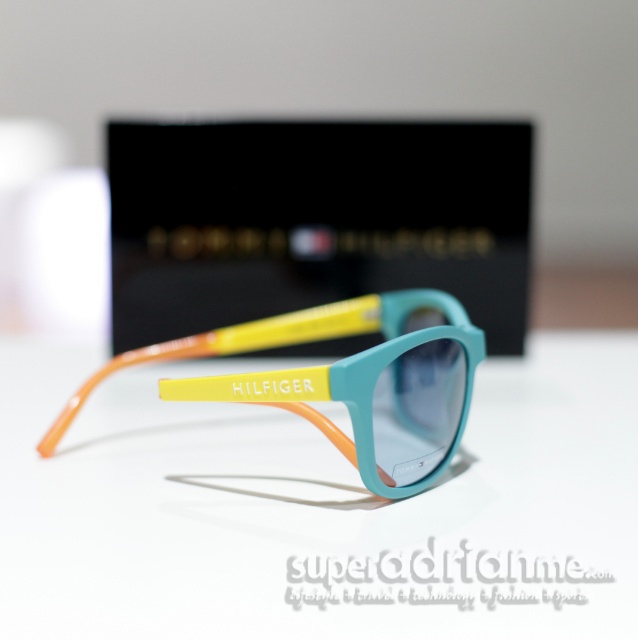
You are holding a smartphone that is 6 inches long and want to place it on the white matte table at center. Can you fit it on the table without it hanging off the edge?

The white matte table at center is 33.22 inches from camera. Since the smartphone is only 6 inches long, it will easily fit on the table without hanging off the edge as the table is significantly longer than the smartphone.

You are taking a photo of the sunglasses and want to focus on the point closer to the camera. Which point should you focus on between point (209, 218) and point (77, 396)?

Point (209, 218) is further to the camera than point (77, 396), so you should focus on point (209, 218).